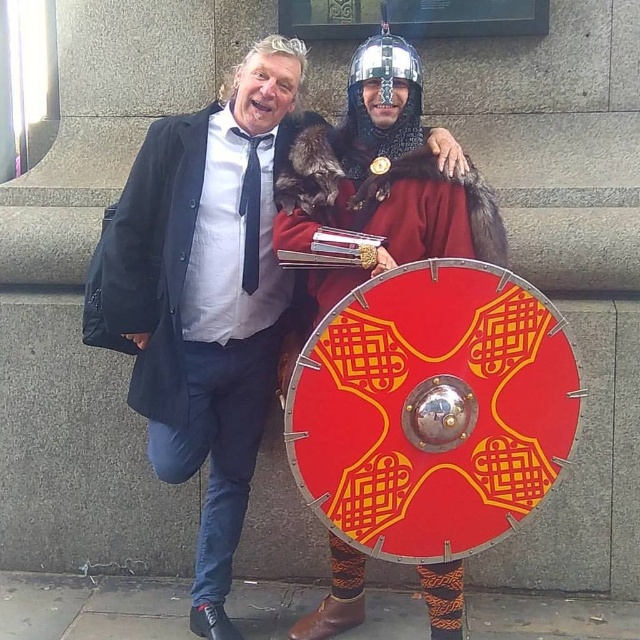
Question: Does matte red shield at center appear over shiny silver helmet at center?

Choices:
 (A) no
 (B) yes

Answer: (A)

Question: Among these points, which one is farthest from the camera?

Choices:
 (A) (211, 484)
 (B) (404, 77)

Answer: (A)

Question: Does matte red shield at center have a larger size compared to shiny silver helmet at center?

Choices:
 (A) yes
 (B) no

Answer: (A)

Question: Can you confirm if matte red shield at center is bigger than shiny silver helmet at center?

Choices:
 (A) yes
 (B) no

Answer: (A)